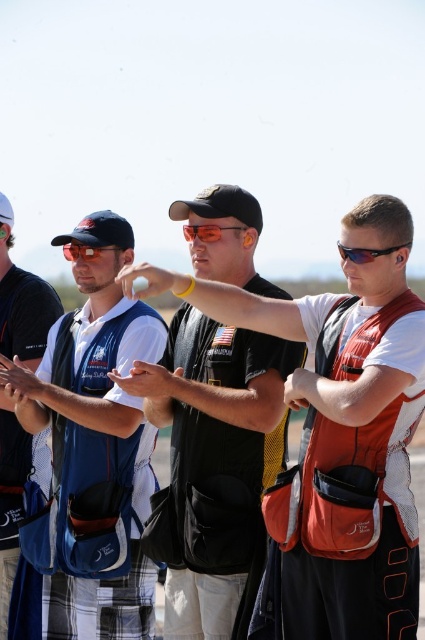
Which of these two, dark blue fabric baseball cap at left or shiny black sunglasses at center, stands taller?

dark blue fabric baseball cap at left is taller.

Between point (93, 241) and point (365, 250), which one is positioned in front?

Point (365, 250)

Locate an element on the screen. dark blue fabric baseball cap at left is located at coordinates (99, 230).

This screenshot has width=425, height=640. Describe the element at coordinates (95, 456) in the screenshot. I see `blue mesh vest at center` at that location.

Is point (79, 467) positioned after point (249, 193)?

No.

Between point (54, 627) and point (234, 204), which one is positioned behind?

Point (234, 204)

Where is `blue mesh vest at center`? blue mesh vest at center is located at coordinates (95, 456).

Is the position of blue fabric vest at left less distant than that of dark blue fabric baseball cap at left?

That is False.

Does blue fabric vest at left have a greater width compared to dark blue fabric baseball cap at left?

In fact, blue fabric vest at left might be narrower than dark blue fabric baseball cap at left.

You are a GUI agent. You are given a task and a screenshot of the screen. Output one action in this format:
    pyautogui.click(x=<x>, y=<y>)
    Task: Click on the blue fabric vest at left
    
    Given the screenshot: What is the action you would take?
    pyautogui.click(x=23, y=307)

Locate an element on the screen. blue fabric vest at left is located at coordinates (23, 307).